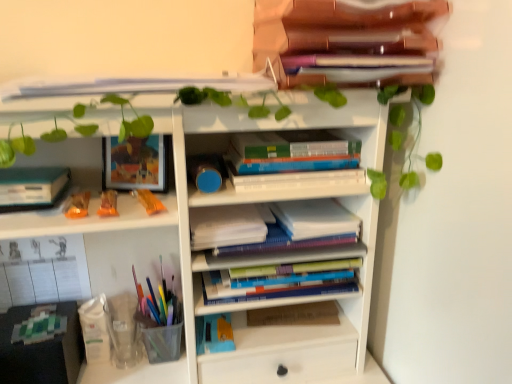
This screenshot has width=512, height=384. Find the location of `free space above white paper at center, which is the third paperback book from right to left (from a real-world perspective)`. free space above white paper at center, which is the third paperback book from right to left (from a real-world perspective) is located at coordinates (225, 213).